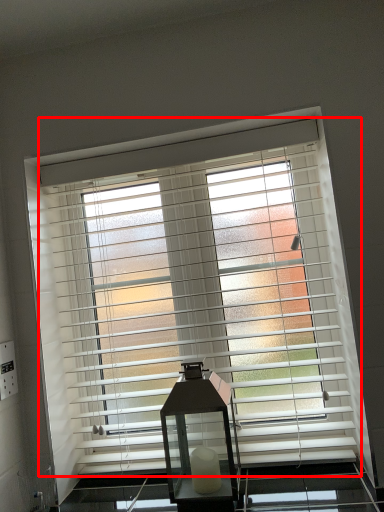
Question: Considering the relative positions of window blind (annotated by the red box) and table lamp in the image provided, where is window blind (annotated by the red box) located with respect to the staircase?

Choices:
 (A) right
 (B) left

Answer: (B)